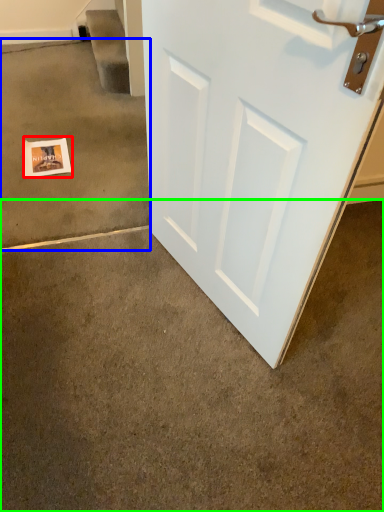
Question: Which object is positioned closest to postcard (highlighted by a red box)? Select from concrete (highlighted by a blue box) and concrete (highlighted by a green box).

Choices:
 (A) concrete
 (B) concrete

Answer: (A)